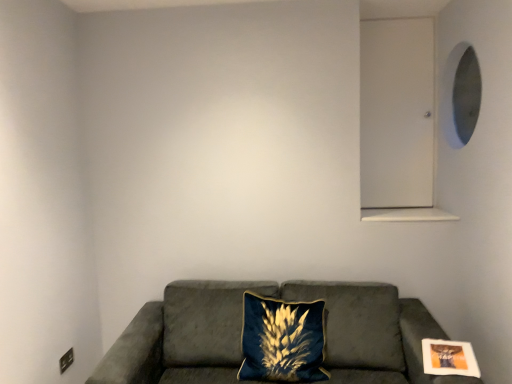
Measure the distance between suede couch at lower center and camera.

suede couch at lower center is 1.80 meters from camera.

Locate an element on the screen. Image resolution: width=512 pixels, height=384 pixels. velvet blue pillow at center is located at coordinates (282, 340).

Image resolution: width=512 pixels, height=384 pixels. Find the location of `studio couch that appears below the matte white picture frame at lower right (from a real-world perspective)`. studio couch that appears below the matte white picture frame at lower right (from a real-world perspective) is located at coordinates (240, 334).

Which is behind, matte white picture frame at lower right or suede couch at lower center?

Positioned behind is matte white picture frame at lower right.

Can you confirm if matte white picture frame at lower right is smaller than suede couch at lower center?

Yes.

Does matte white picture frame at lower right appear on the right side of velvet blue pillow at center?

Yes, matte white picture frame at lower right is to the right of velvet blue pillow at center.

Does matte white picture frame at lower right turn towards velvet blue pillow at center?

No, matte white picture frame at lower right is not oriented towards velvet blue pillow at center.

From the image's perspective, which object appears higher, matte white picture frame at lower right or velvet blue pillow at center?

matte white picture frame at lower right appears higher in the image.

Which is behind, point (452, 351) or point (308, 328)?

Point (308, 328)

Between velvet blue pillow at center and suede couch at lower center, which one has smaller size?

velvet blue pillow at center is smaller.

You are a GUI agent. You are given a task and a screenshot of the screen. Output one action in this format:
    pyautogui.click(x=<x>, y=<y>)
    Task: Click on the studio couch in front of the velvet blue pillow at center
    
    Given the screenshot: What is the action you would take?
    pyautogui.click(x=240, y=334)

Considering the sizes of velvet blue pillow at center and suede couch at lower center in the image, is velvet blue pillow at center wider or thinner than suede couch at lower center?

Clearly, velvet blue pillow at center has less width compared to suede couch at lower center.

From a real-world perspective, who is located higher, velvet blue pillow at center or matte white picture frame at lower right?

In real-world perspective, matte white picture frame at lower right is above.

Does velvet blue pillow at center have a lesser width compared to matte white picture frame at lower right?

No.

Are velvet blue pillow at center and matte white picture frame at lower right far apart?

That's not correct — velvet blue pillow at center is a little close to matte white picture frame at lower right.

Consider the image. Could you tell me if velvet blue pillow at center is turned towards matte white picture frame at lower right?

No, velvet blue pillow at center does not turn towards matte white picture frame at lower right.

Is suede couch at lower center at the left side of matte white picture frame at lower right?

Yes.

Between suede couch at lower center and matte white picture frame at lower right, which one has larger width?

suede couch at lower center.

Which is in front, point (182, 367) or point (468, 375)?

The point (468, 375) is in front.

Which of these two, suede couch at lower center or matte white picture frame at lower right, is smaller?

matte white picture frame at lower right.

From the image's perspective, relative to velvet blue pillow at center, is suede couch at lower center above or below?

Clearly, from the image's perspective, suede couch at lower center is below velvet blue pillow at center.

How many degrees apart are the facing directions of suede couch at lower center and velvet blue pillow at center?

There is a 6.34-degree angle between the facing directions of suede couch at lower center and velvet blue pillow at center.

Based on the photo, is suede couch at lower center located outside velvet blue pillow at center?

Yes, suede couch at lower center is not within velvet blue pillow at center.

From a real-world perspective, who is located higher, suede couch at lower center or velvet blue pillow at center?

velvet blue pillow at center is physically above.

You are a GUI agent. You are given a task and a screenshot of the screen. Output one action in this format:
    pyautogui.click(x=<x>, y=<y>)
    Task: Click on the picture frame that appears above the suede couch at lower center (from the image's perspective)
    The width and height of the screenshot is (512, 384).
    Given the screenshot: What is the action you would take?
    pyautogui.click(x=449, y=358)

Locate an element on the screen. The width and height of the screenshot is (512, 384). picture frame that appears on the right of velvet blue pillow at center is located at coordinates (449, 358).

Which object lies nearer to the anchor point matte white picture frame at lower right, velvet blue pillow at center or suede couch at lower center?

suede couch at lower center is positioned closer to the anchor matte white picture frame at lower right.

When comparing their distances from matte white picture frame at lower right, does suede couch at lower center or velvet blue pillow at center seem closer?

Based on the image, suede couch at lower center appears to be nearer to matte white picture frame at lower right.

Considering their positions, is suede couch at lower center positioned closer to velvet blue pillow at center than matte white picture frame at lower right?

suede couch at lower center.

Considering their positions, is matte white picture frame at lower right positioned further to velvet blue pillow at center than suede couch at lower center?

matte white picture frame at lower right is further to velvet blue pillow at center.

Considering their positions, is velvet blue pillow at center positioned further to suede couch at lower center than matte white picture frame at lower right?

Based on the image, matte white picture frame at lower right appears to be further to suede couch at lower center.

Considering their positions, is matte white picture frame at lower right positioned closer to suede couch at lower center than velvet blue pillow at center?

velvet blue pillow at center lies closer to suede couch at lower center than the other object.

At what (x,y) coordinates should I click in order to perform the action: click on pillow situated between suede couch at lower center and matte white picture frame at lower right from left to right. Please return your answer as a coordinate pair (x, y). The height and width of the screenshot is (384, 512). Looking at the image, I should click on (282, 340).